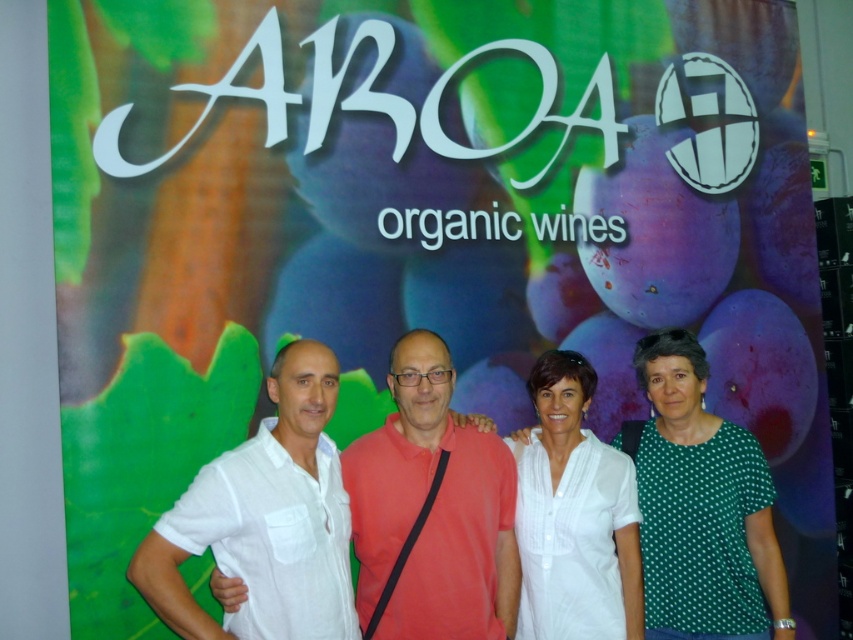
You are a photographer setting up for a group photo. You notice two white shirts in the center of the scene. The first is a linen shirt and the second is a matte shirt. Given that your camera has a depth of field that can sharply focus on objects within 25 inches of each other, will both the white linen shirt at center and the white matte shirt at center be in focus simultaneously?

The white linen shirt at center is 26.74 inches away from the white matte shirt at center. Since the distance between them exceeds the camera lens depth of field limit of 25 inches, both shirts cannot be in focus at the same time.